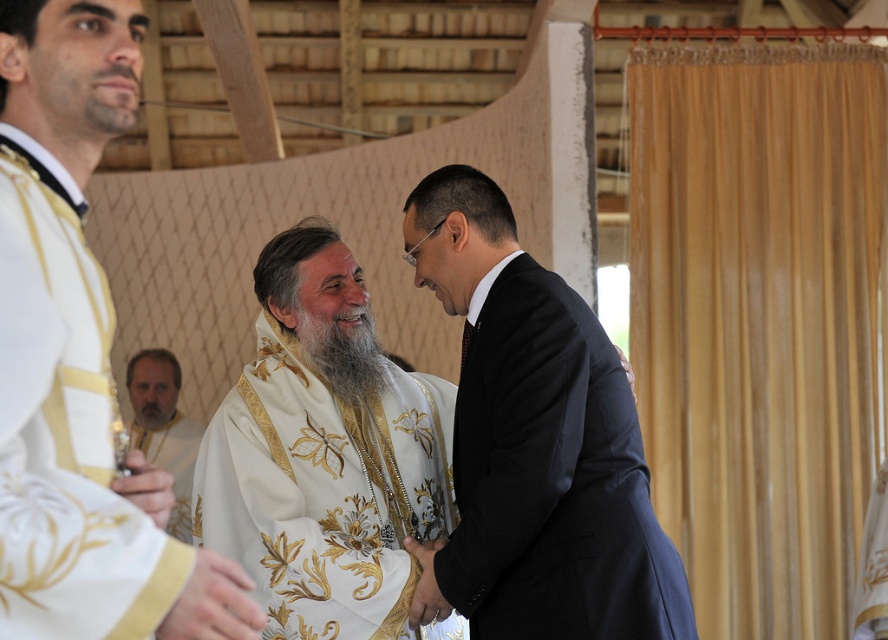
You are a photographer standing in the church scene. You need to capture a closeup of the white silk handkerchief at lower left without the white silk robe at lower left appearing in the frame. Is this possible given their positions?

The white silk robe at lower left is below the white silk handkerchief at lower left. Since the robe is positioned lower, you can adjust the camera angle to focus on the handkerchief above while excluding the robe from the frame.

You are an interior designer observing the scene. You need to determine if the white silk handkerchief at lower left can be placed on top of the white silk robe at lower left without slipping off. Based on their sizes, what do you think?

The white silk robe at lower left is taller than the white silk handkerchief at lower left. Since the robe is taller, the handkerchief can be placed on top without slipping off as long as its dimensions are within the robe.

You are standing in the church and want to take a photo of the white embroidered robe at left. Where should you position yourself to capture it in the frame?

To capture the white embroidered robe at left in your photo, position yourself facing the robe, ensuring it is centered within your camera frame. Since the robe is located at point (67, 433), align your camera accordingly.